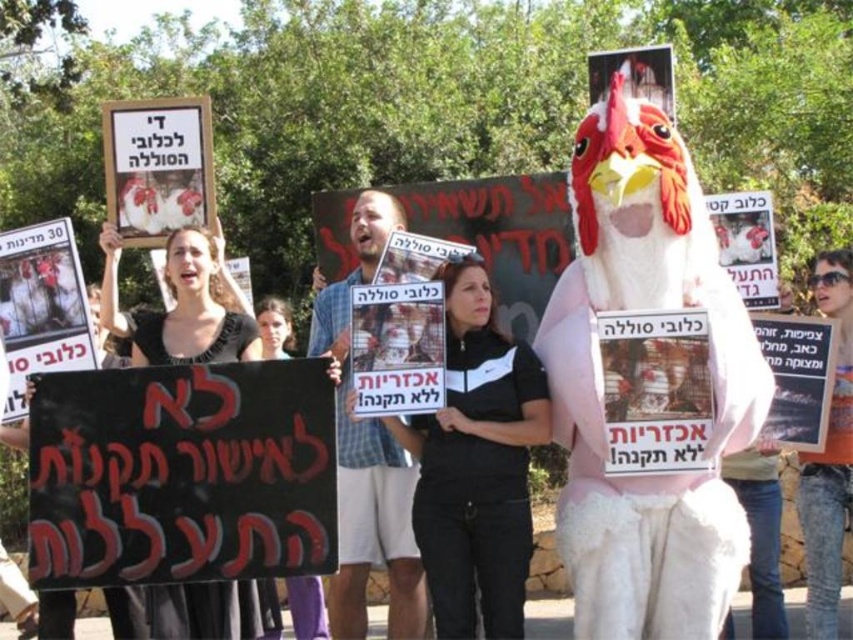
Who is taller, black fabric shirt at center or black fabric at center?

Standing taller between the two is black fabric at center.

Find the location of `black fabric shirt at center`. black fabric shirt at center is located at coordinates (476, 465).

Between point (479, 300) and point (161, 323), which one is positioned behind?

Point (161, 323)

Locate an element on the screen. The height and width of the screenshot is (640, 853). black fabric shirt at center is located at coordinates (476, 465).

Is black fabric shirt at center wider than orange t-shirt at center?

In fact, black fabric shirt at center might be narrower than orange t-shirt at center.

Who is shorter, black fabric shirt at center or orange t-shirt at center?

Standing shorter between the two is black fabric shirt at center.

Between point (439, 467) and point (834, 371), which one is positioned in front?

Positioned in front is point (834, 371).

The height and width of the screenshot is (640, 853). I want to click on black fabric shirt at center, so click(x=476, y=465).

Is plaid shirt at center behind orange t-shirt at center?

That is False.

Who is more distant from viewer, (415, 557) or (804, 528)?

Point (415, 557)

The width and height of the screenshot is (853, 640). What are the coordinates of `plaid shirt at center` in the screenshot? It's located at (368, 458).